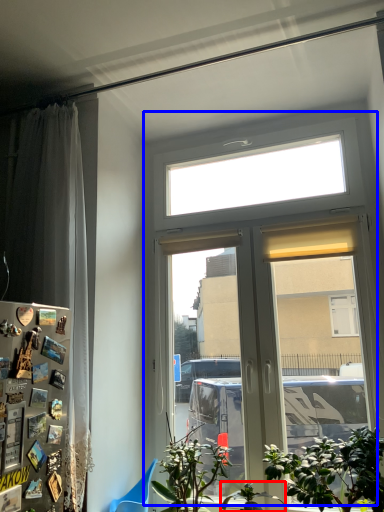
Question: Which point is closer to the camera, houseplant (highlighted by a red box) or window (highlighted by a blue box)?

Choices:
 (A) houseplant
 (B) window

Answer: (A)